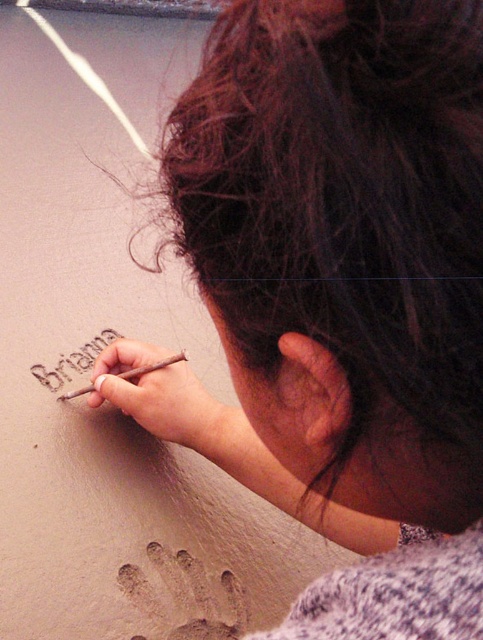
You are an artist trying to draw on the sand. You have two pencils available. Which pencil is closer to you, the smooth wooden pencil at center or the brown wooden pencil at lower left?

The smooth wooden pencil at center is closer to you because it is in front of the brown wooden pencil at lower left.

You are a teacher observing a student who is writing on a sandy surface. The student is using a brown wooden pencil at lower left to etch a brown clay name at center. Which object is larger in size?

The brown clay name at center is bigger than the brown wooden pencil at lower left.